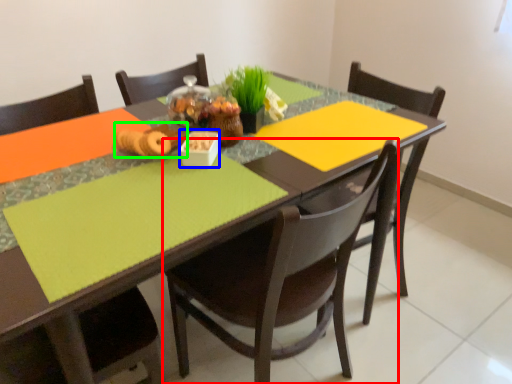
Question: Which object is the farthest from chair (highlighted by a red box)? Choose among these: tableware (highlighted by a blue box) or food (highlighted by a green box).

Choices:
 (A) tableware
 (B) food

Answer: (B)